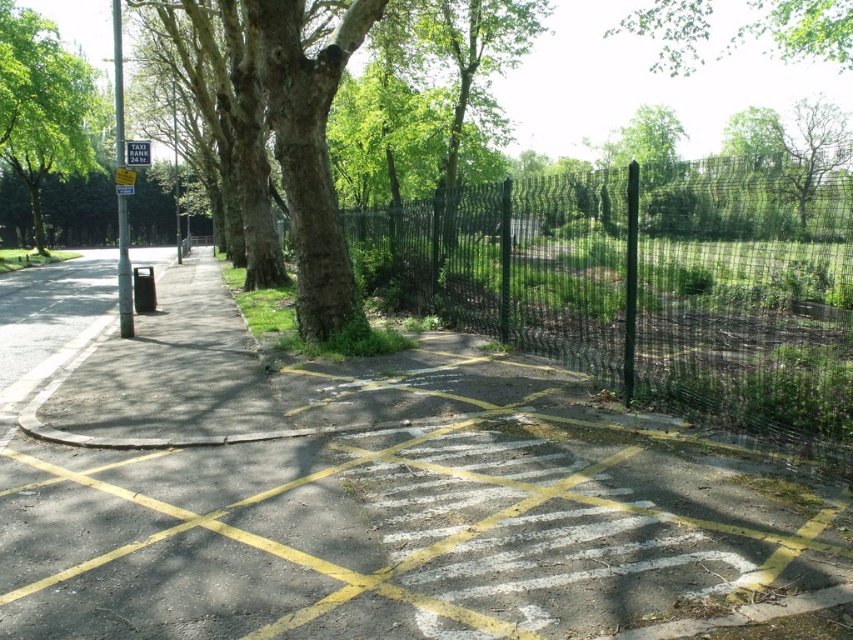
Is point (22, 32) less distant than point (128, 157)?

No, it is not.

Does point (45, 115) come behind point (141, 141)?

Yes, point (45, 115) is farther from viewer.

Does point (67, 52) come behind point (134, 160)?

That is True.

The width and height of the screenshot is (853, 640). I want to click on green leafy tree at left, so click(x=44, y=106).

Is green wire mesh fence at center taller than green leafy tree at upper center?

No.

Is point (593, 284) positioned after point (700, 20)?

No, it is not.

Where is `green wire mesh fence at center`? The image size is (853, 640). green wire mesh fence at center is located at coordinates (648, 285).

Between green rough bark tree at upper left and metallic rectangular sign at upper left, which one appears on the right side from the viewer's perspective?

green rough bark tree at upper left is more to the right.

Who is shorter, green rough bark tree at upper left or metallic rectangular sign at upper left?

metallic rectangular sign at upper left

Find the location of a particular element. The width and height of the screenshot is (853, 640). green rough bark tree at upper left is located at coordinates (285, 145).

The image size is (853, 640). Find the location of `green rough bark tree at upper left`. green rough bark tree at upper left is located at coordinates (285, 145).